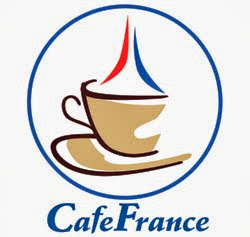
At what (x,y) coordinates should I click in order to perform the action: click on cup. Please return your answer as a coordinate pair (x, y). Looking at the image, I should click on [106, 111].